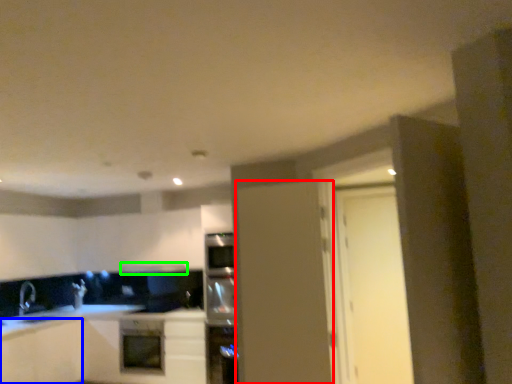
Question: Which is farther away from door (highlighted by a red box)? cabinetry (highlighted by a blue box) or exhaust hood (highlighted by a green box)?

Choices:
 (A) cabinetry
 (B) exhaust hood

Answer: (A)